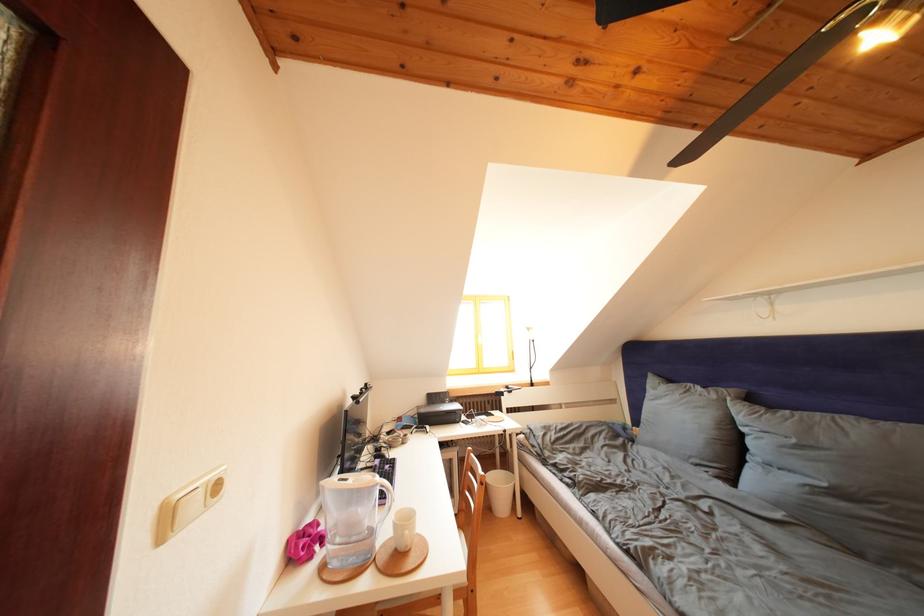
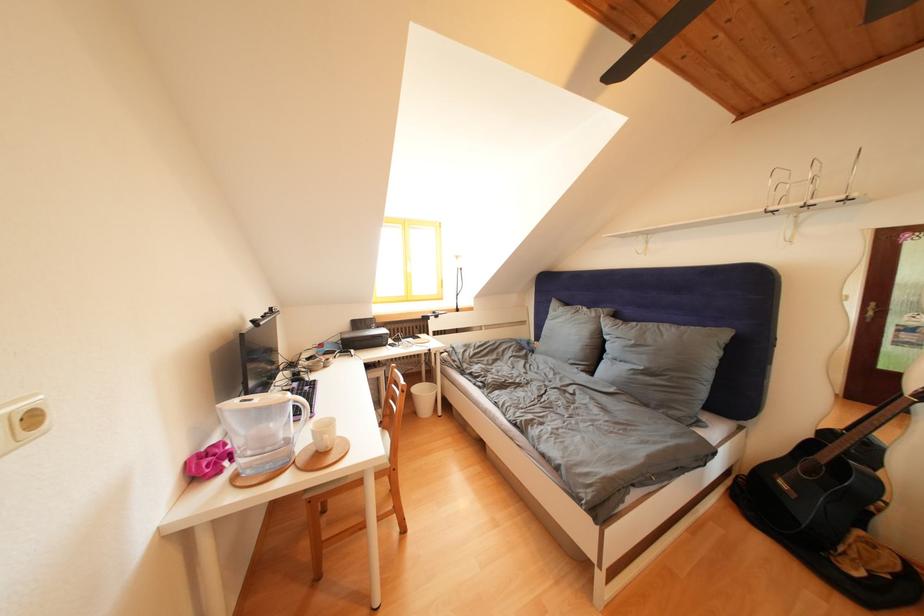
In the second image, find the point that corresponds to pixel 399 540 in the first image.

(320, 446)